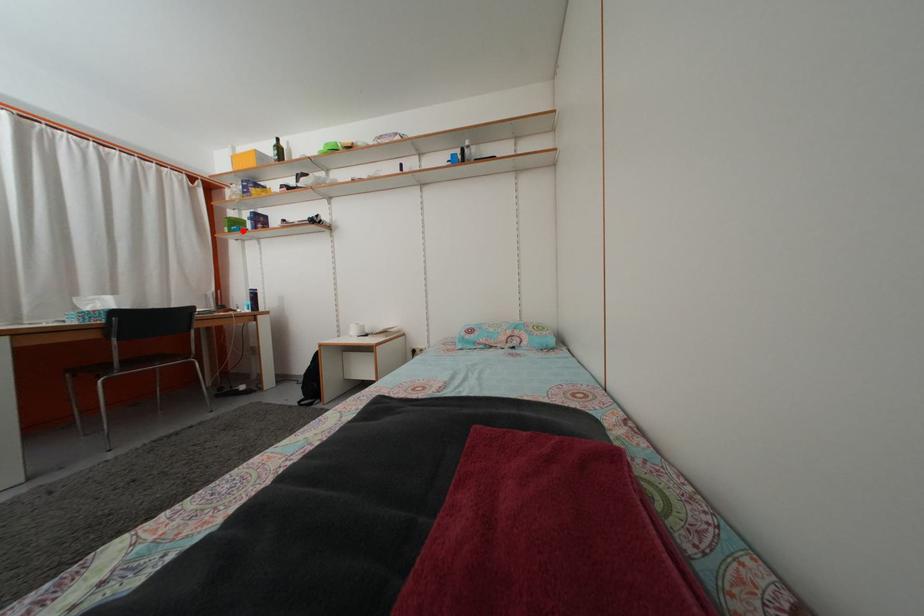
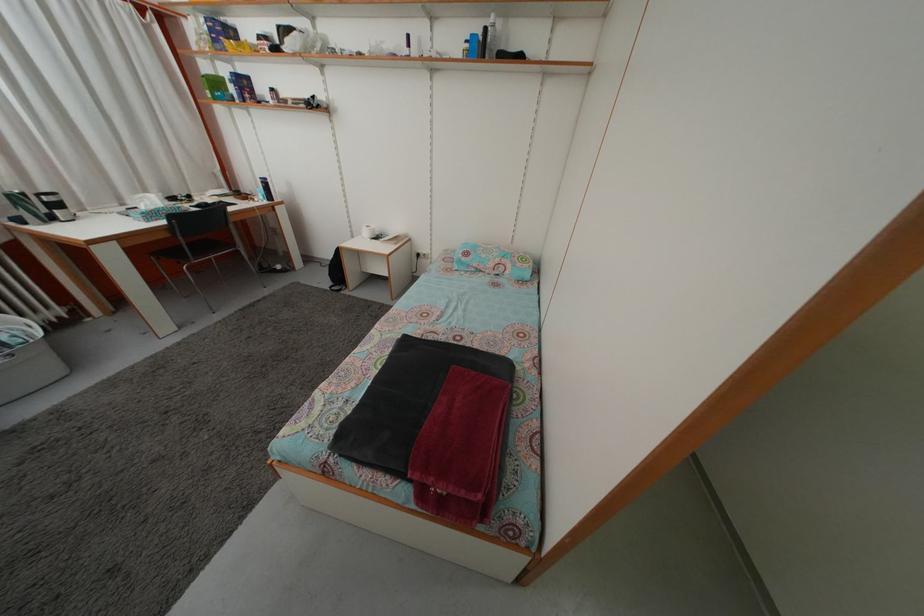
In the second image, find the point that corresponds to the highlighted location in the first image.

(223, 91)